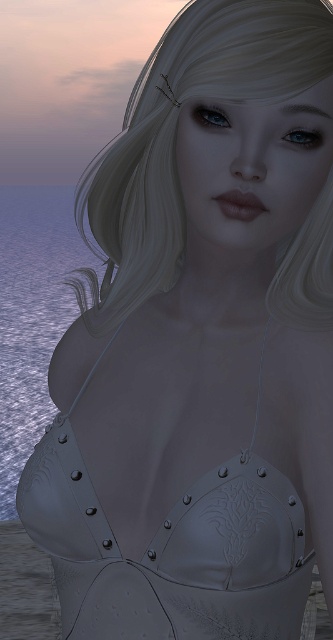
Who is more distant from viewer, [307,323] or [39,259]?

Positioned behind is point [39,259].

Does blonde hair at upper center come in front of blue water at left?

Yes, it is.

Which is in front, point (141, 284) or point (39, 282)?

Point (141, 284) is in front.

This screenshot has width=333, height=640. Find the location of `blonde hair at upper center`. blonde hair at upper center is located at coordinates 176,132.

Does silver metallic corset at center have a lesser width compared to blue water at left?

Correct, silver metallic corset at center's width is less than blue water at left's.

Between point (16, 497) and point (60, 301), which one is positioned behind?

Point (60, 301)

Who is more distant from viewer, [105,616] or [6,518]?

Point [6,518]

The width and height of the screenshot is (333, 640). I want to click on silver metallic corset at center, so click(171, 548).

Between silver metallic corset at center and blonde hair at upper center, which one appears on the right side from the viewer's perspective?

Positioned to the right is blonde hair at upper center.

Which is behind, point (192, 544) or point (203, 92)?

The point (192, 544) is behind.

Measure the distance between silver metallic corset at center and camera.

A distance of 22.18 inches exists between silver metallic corset at center and camera.

Where is `silver metallic corset at center`? silver metallic corset at center is located at coordinates (171, 548).